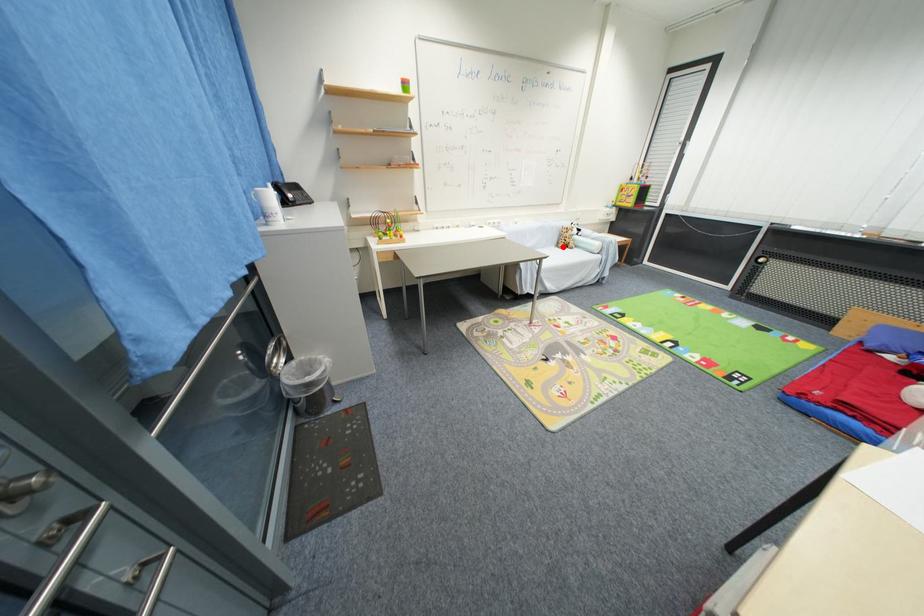
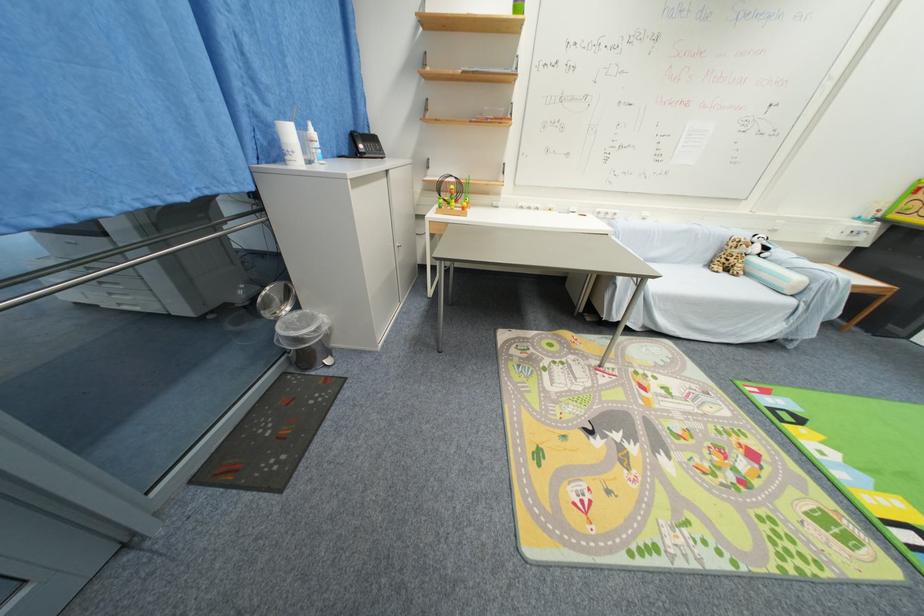
In the second image, find the point that corresponds to the highlighted location in the first image.

(714, 265)